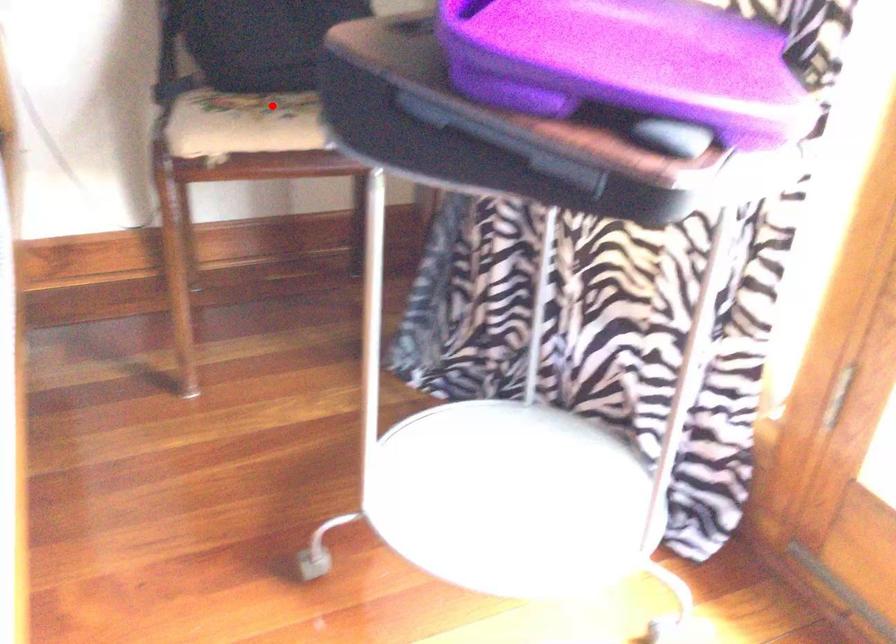
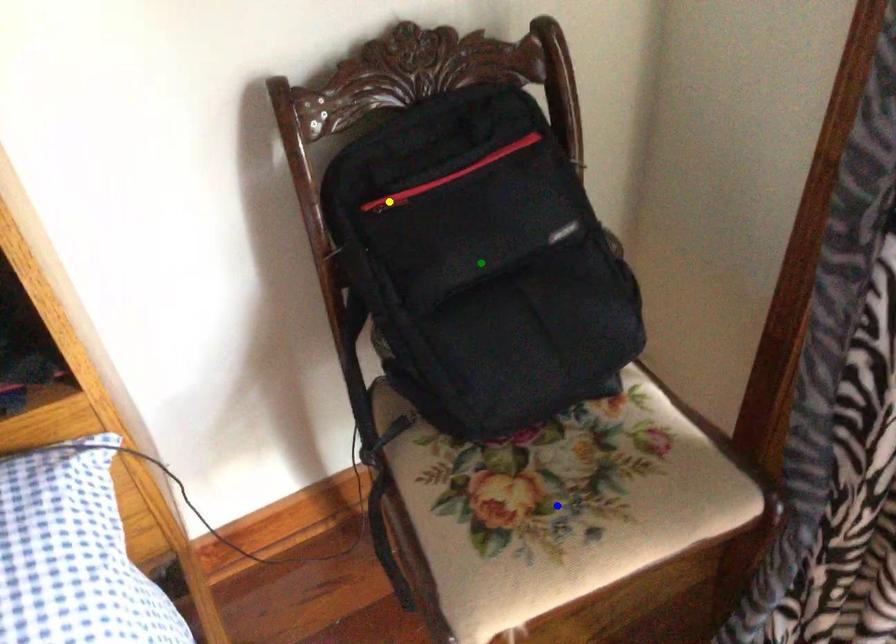
Question: I am providing you with two images of the same scene from different viewpoints. A red point is marked on the first image. You are given multiple points on the second image. Which point in image 2 represents the same 3d spot as the red point in image 1?

Choices:
 (A) yellow point
 (B) green point
 (C) blue point

Answer: (C)